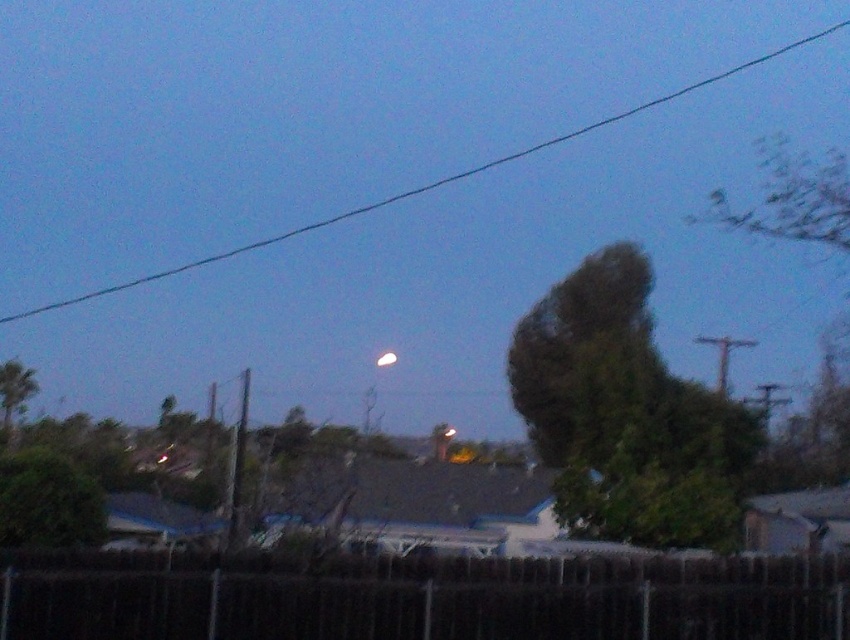
How much distance is there between black wire at upper center and white glossy moon at upper center?

black wire at upper center and white glossy moon at upper center are 17.47 meters apart from each other.

The width and height of the screenshot is (850, 640). I want to click on black wire at upper center, so click(x=425, y=184).

Is point (259, 248) behind point (389, 365)?

Yes, point (259, 248) is farther from viewer.

Image resolution: width=850 pixels, height=640 pixels. Identify the location of black wire at upper center. (425, 184).

Which is below, black metal fence at lower center or green leafy tree at upper right?

black metal fence at lower center

Who is more distant from viewer, (185, 561) or (551, 314)?

Point (551, 314)

You are a GUI agent. You are given a task and a screenshot of the screen. Output one action in this format:
    pyautogui.click(x=<x>, y=<y>)
    Task: Click on the black metal fence at lower center
    This screenshot has width=850, height=640.
    Given the screenshot: What is the action you would take?
    pyautogui.click(x=417, y=596)

Is point (575, 612) closer to viewer compared to point (252, 244)?

Yes, it is.

Is black metal fence at lower center closer to the viewer compared to black wire at upper center?

Yes.

Is point (202, 600) positioned before point (3, 317)?

Yes.

This screenshot has height=640, width=850. In order to click on black metal fence at lower center in this screenshot , I will do `click(417, 596)`.